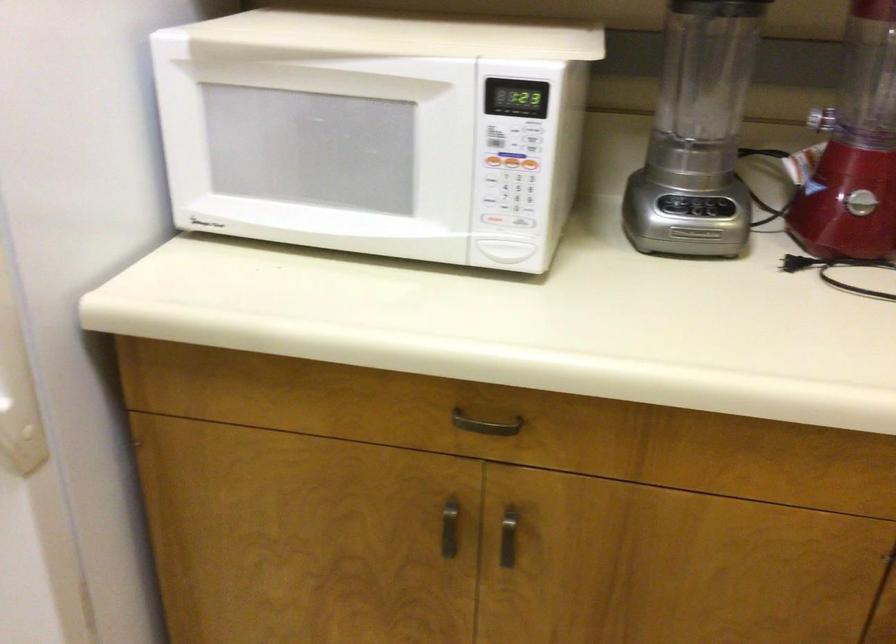
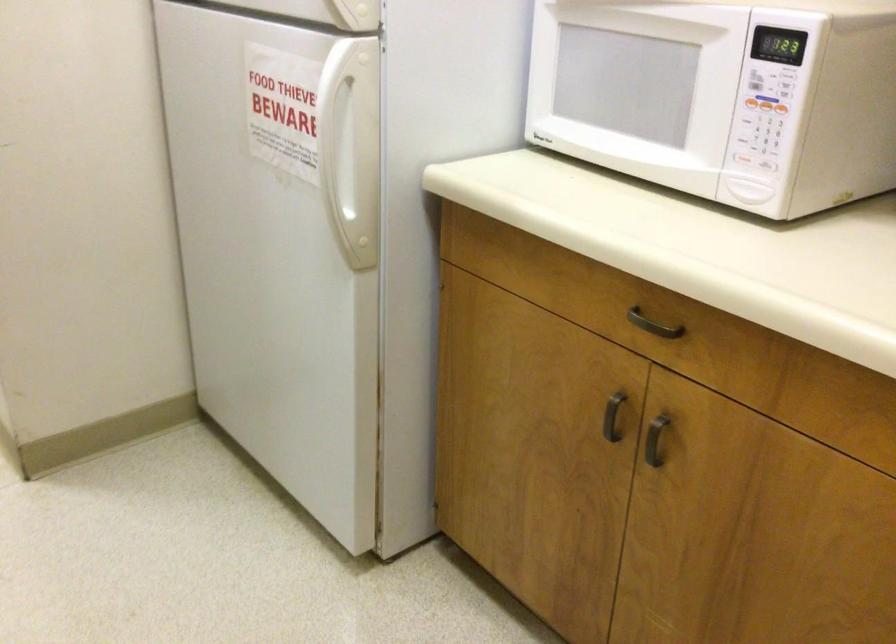
Question: Based on the continuous images, in which direction is the camera rotating? Reply with the corresponding letter.

Choices:
 (A) Left
 (B) Right
 (C) Up
 (D) Down

Answer: (A)